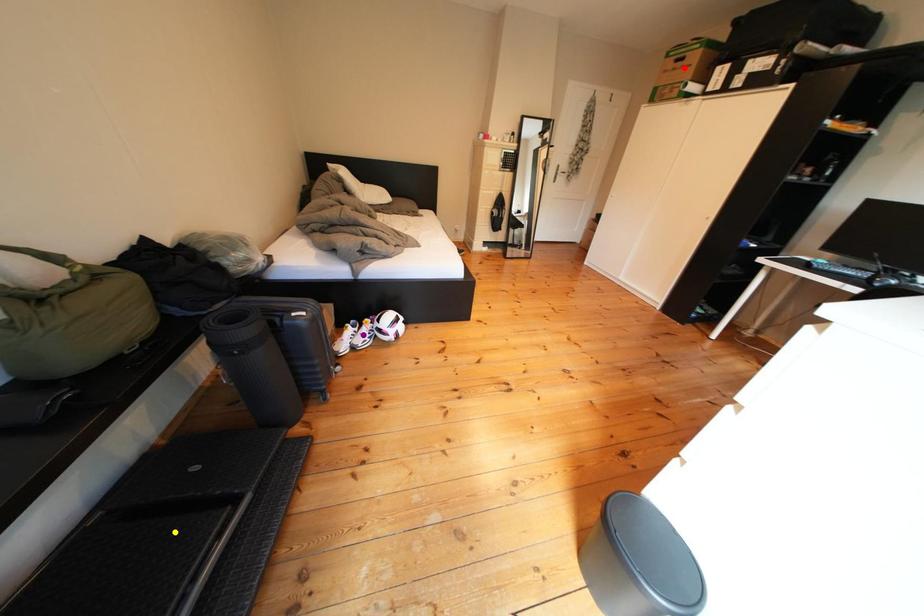
Order these from nearest to farthest:
purple point, yellow point, red point

yellow point < purple point < red point